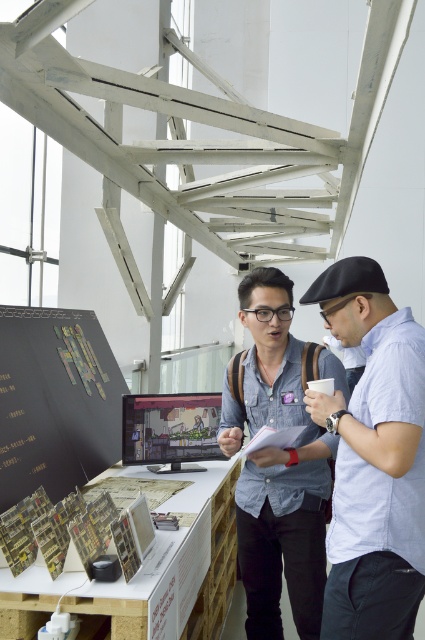
Question: Does light blue shirt at center have a smaller size compared to denim shirt at center?

Choices:
 (A) yes
 (B) no

Answer: (A)

Question: Which object is the closest to the light blue shirt at center?

Choices:
 (A) denim shirt at center
 (B) matte black monitor at center

Answer: (A)

Question: Which of the following is the farthest from the observer?

Choices:
 (A) (334, 577)
 (B) (316, 449)

Answer: (B)

Question: Which point is closer to the camera?

Choices:
 (A) light blue shirt at center
 (B) matte black monitor at center

Answer: (A)

Question: Does light blue shirt at center appear over denim shirt at center?

Choices:
 (A) no
 (B) yes

Answer: (B)

Question: Does denim shirt at center appear on the right side of matte black monitor at center?

Choices:
 (A) no
 (B) yes

Answer: (B)